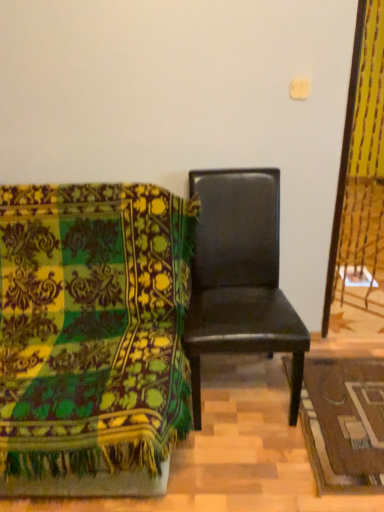
Question: Considering the relative sizes of velvet green chair at left, arranged as the first chair when viewed from the left, and brown woven mat at lower right in the image provided, is velvet green chair at left, arranged as the first chair when viewed from the left, bigger than brown woven mat at lower right?

Choices:
 (A) no
 (B) yes

Answer: (B)

Question: Can you confirm if velvet green chair at left, arranged as the first chair when viewed from the left, is smaller than brown woven mat at lower right?

Choices:
 (A) yes
 (B) no

Answer: (B)

Question: Are velvet green chair at left, arranged as the first chair when viewed from the left, and brown woven mat at lower right beside each other?

Choices:
 (A) no
 (B) yes

Answer: (A)

Question: Can you confirm if velvet green chair at left, arranged as the 2th chair when viewed from the right, is thinner than brown woven mat at lower right?

Choices:
 (A) no
 (B) yes

Answer: (A)

Question: From a real-world perspective, is velvet green chair at left, arranged as the first chair when viewed from the left, beneath brown woven mat at lower right?

Choices:
 (A) no
 (B) yes

Answer: (A)

Question: From the image's perspective, would you say velvet green chair at left, arranged as the 2th chair when viewed from the right, is shown under brown woven mat at lower right?

Choices:
 (A) yes
 (B) no

Answer: (B)

Question: Is black leather chair at center, which is counted as the first chair, starting from the right, aimed at velvet green chair at left, arranged as the first chair when viewed from the left?

Choices:
 (A) no
 (B) yes

Answer: (A)

Question: From the image's perspective, is black leather chair at center, the 2th chair from the left, under velvet green chair at left, arranged as the 2th chair when viewed from the right?

Choices:
 (A) no
 (B) yes

Answer: (A)

Question: Would you say black leather chair at center, which is counted as the first chair, starting from the right, contains velvet green chair at left, arranged as the 2th chair when viewed from the right?

Choices:
 (A) yes
 (B) no

Answer: (B)

Question: Does black leather chair at center, which is counted as the first chair, starting from the right, appear on the left side of velvet green chair at left, arranged as the 2th chair when viewed from the right?

Choices:
 (A) no
 (B) yes

Answer: (A)

Question: Does black leather chair at center, which is counted as the first chair, starting from the right, have a greater width compared to velvet green chair at left, arranged as the 2th chair when viewed from the right?

Choices:
 (A) yes
 (B) no

Answer: (B)

Question: From the image's perspective, is black leather chair at center, which is counted as the first chair, starting from the right, above velvet green chair at left, arranged as the 2th chair when viewed from the right?

Choices:
 (A) no
 (B) yes

Answer: (B)

Question: Considering the relative sizes of velvet green chair at left, arranged as the first chair when viewed from the left, and black leather chair at center, the 2th chair from the left, in the image provided, is velvet green chair at left, arranged as the first chair when viewed from the left, smaller than black leather chair at center, the 2th chair from the left,?

Choices:
 (A) yes
 (B) no

Answer: (B)